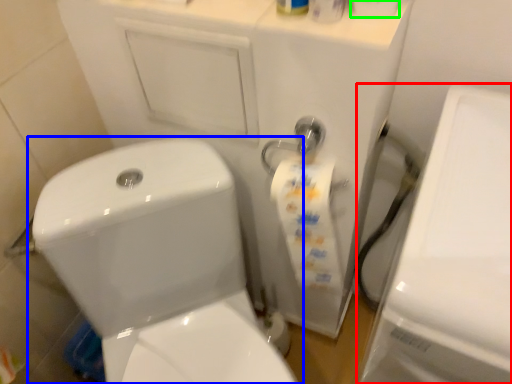
Question: Estimate the real-world distances between objects in this image. Which object is farther from porcelain (highlighted by a red box), toilet (highlighted by a blue box) or toilet paper (highlighted by a green box)?

Choices:
 (A) toilet
 (B) toilet paper

Answer: (A)